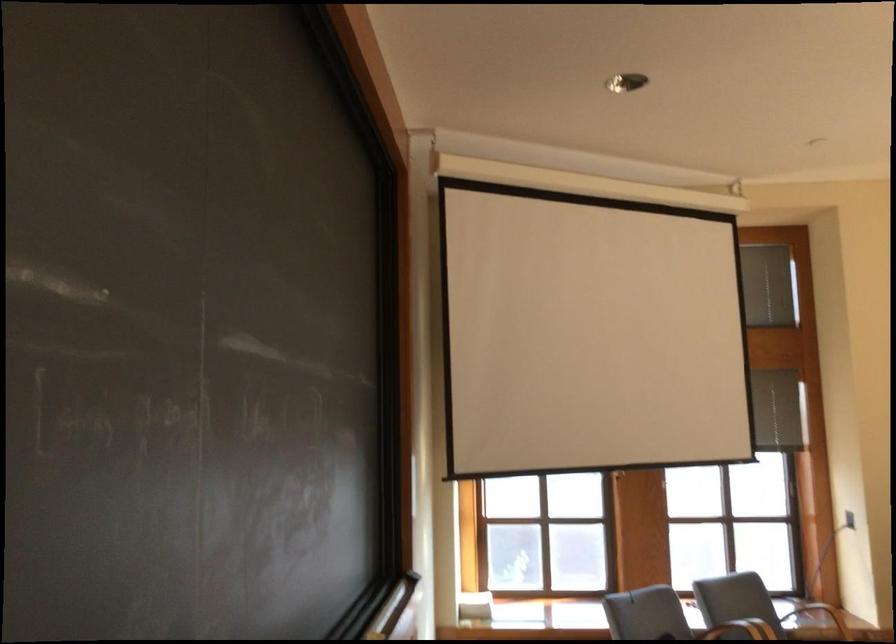
Image resolution: width=896 pixels, height=644 pixels. Describe the element at coordinates (574, 200) in the screenshot. I see `the projector screen bar` at that location.